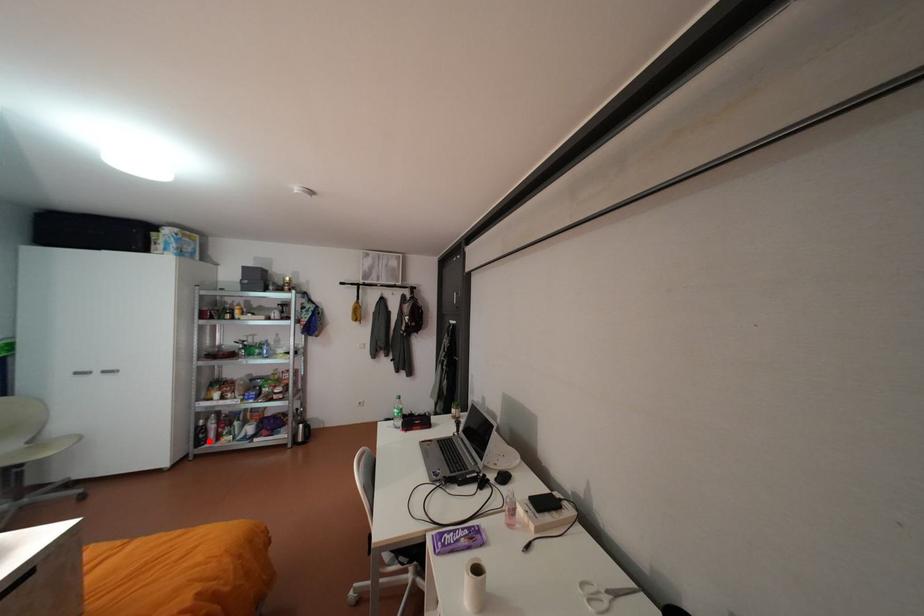
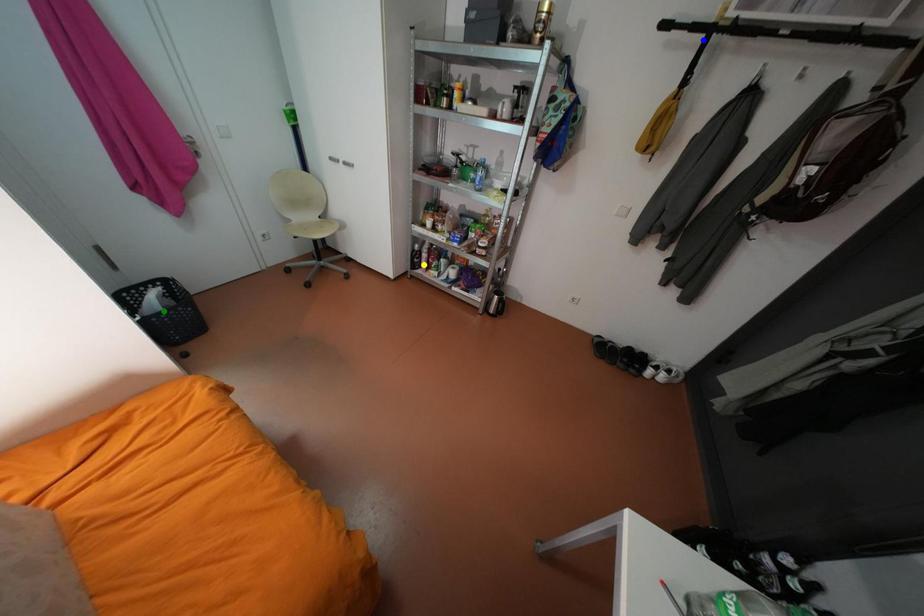
Question: I am providing you with two images of the same scene from different viewpoints. A red point is marked on the first image. You are given multiple points on the second image. In image 2, which mark is for the same physical point as the one in image 1?

Choices:
 (A) green point
 (B) blue point
 (C) yellow point

Answer: (C)